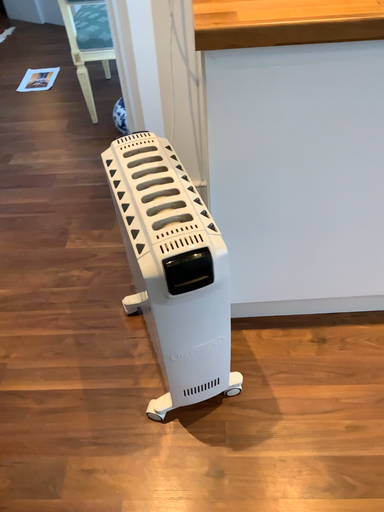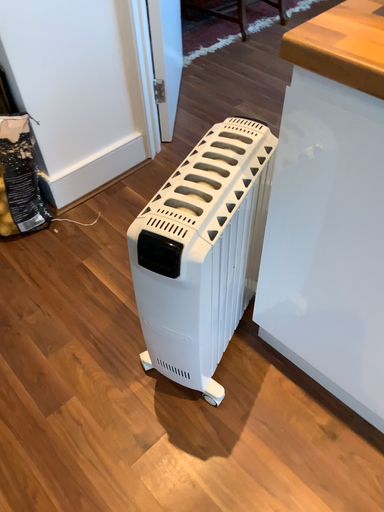
Question: How did the camera likely rotate when shooting the video?

Choices:
 (A) rotated upward
 (B) rotated downward

Answer: (A)